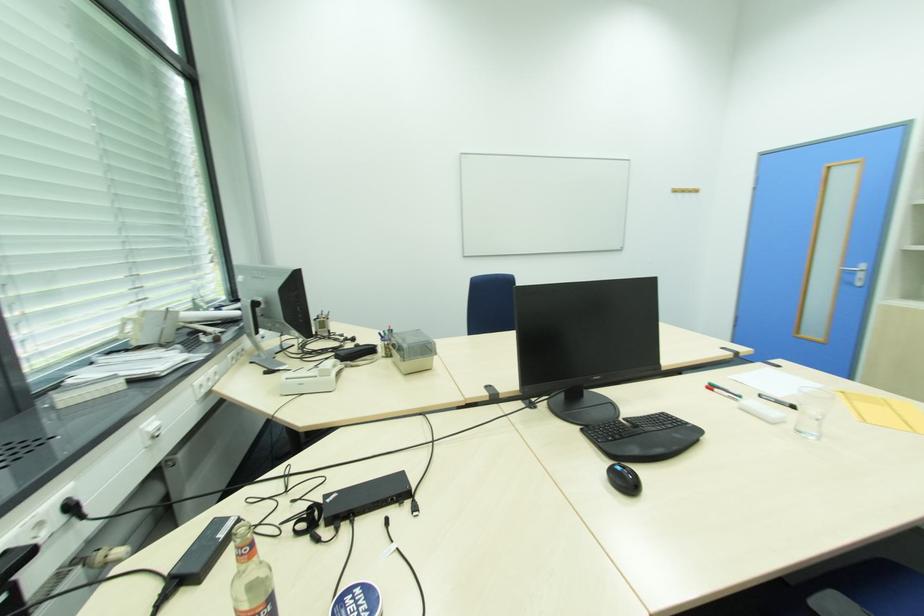
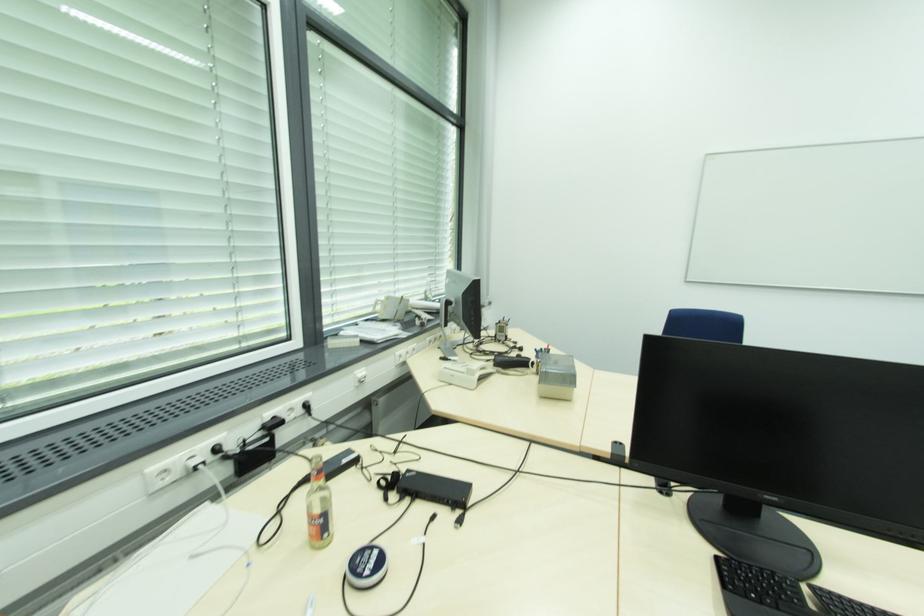
Find the pixel in the second image that matches pixel 40 527 in the first image.

(294, 410)